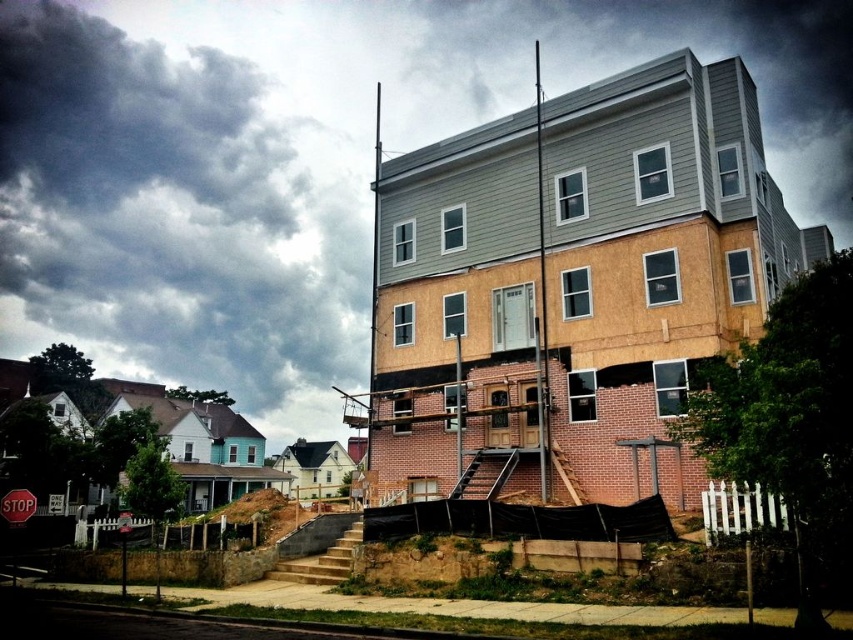
Between smooth gray siding at upper center and brown dirt at lower left, which one is positioned lower?

Positioned lower is brown dirt at lower left.

The width and height of the screenshot is (853, 640). What do you see at coordinates (312, 161) in the screenshot?
I see `smooth gray siding at upper center` at bounding box center [312, 161].

This screenshot has height=640, width=853. Find the location of `smooth gray siding at upper center`. smooth gray siding at upper center is located at coordinates (312, 161).

Which of these two, smooth gray siding at upper center or red matte stop sign at lower left, stands shorter?

red matte stop sign at lower left is shorter.

Which is behind, point (74, 310) or point (12, 508)?

The point (74, 310) is more distant.

At what (x,y) coordinates should I click in order to perform the action: click on smooth gray siding at upper center. Please return your answer as a coordinate pair (x, y). This screenshot has height=640, width=853. Looking at the image, I should click on (312, 161).

Can you confirm if cloudy sky at upper left is positioned above brown dirt at lower left?

Yes.

Who is shorter, cloudy sky at upper left or brown dirt at lower left?

With less height is brown dirt at lower left.

Who is more distant from viewer, (119, 208) or (292, 515)?

The point (119, 208) is more distant.

You are a GUI agent. You are given a task and a screenshot of the screen. Output one action in this format:
    pyautogui.click(x=<x>, y=<y>)
    Task: Click on the cloudy sky at upper left
    This screenshot has height=640, width=853.
    Given the screenshot: What is the action you would take?
    pyautogui.click(x=189, y=200)